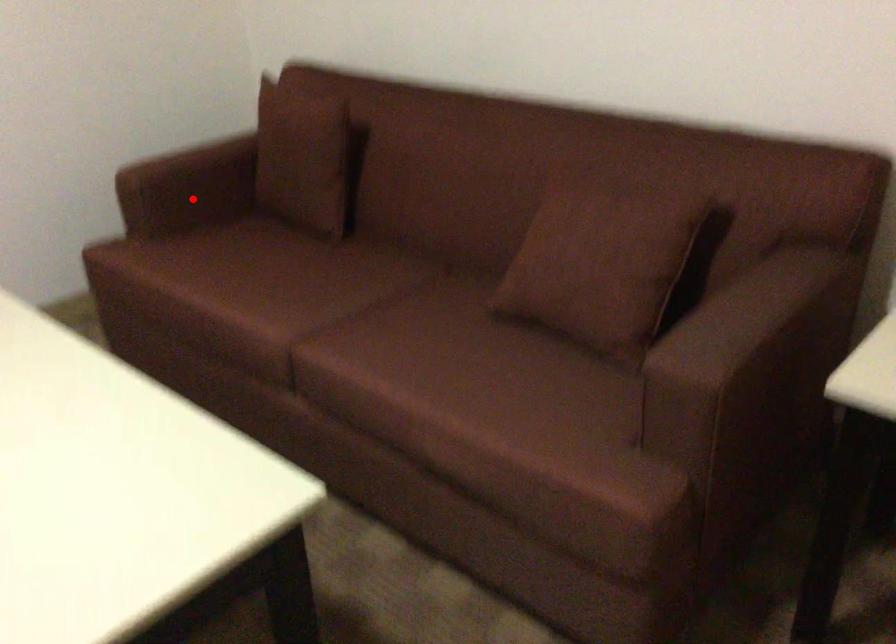
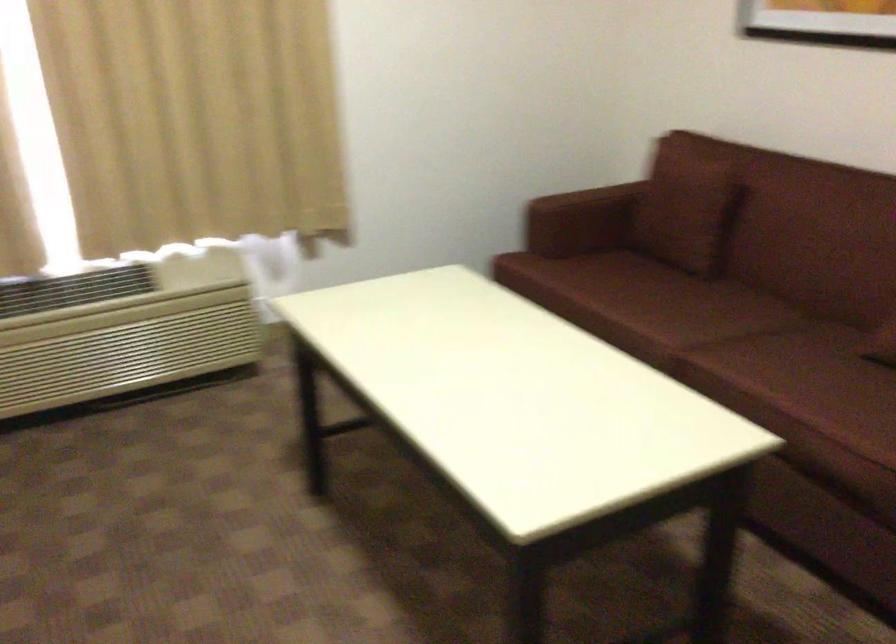
Question: A red point is marked in image1. In image2, is the corresponding 3D point closer to the camera or farther? Reply with the corresponding letter.

Choices:
 (A) The corresponding 3D point is closer.
 (B) The corresponding 3D point is farther.

Answer: (B)